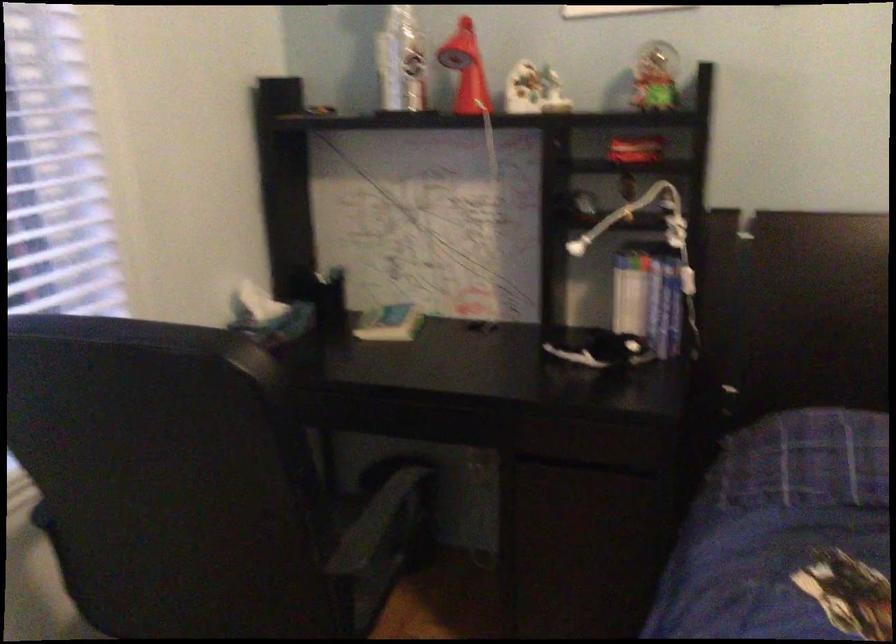
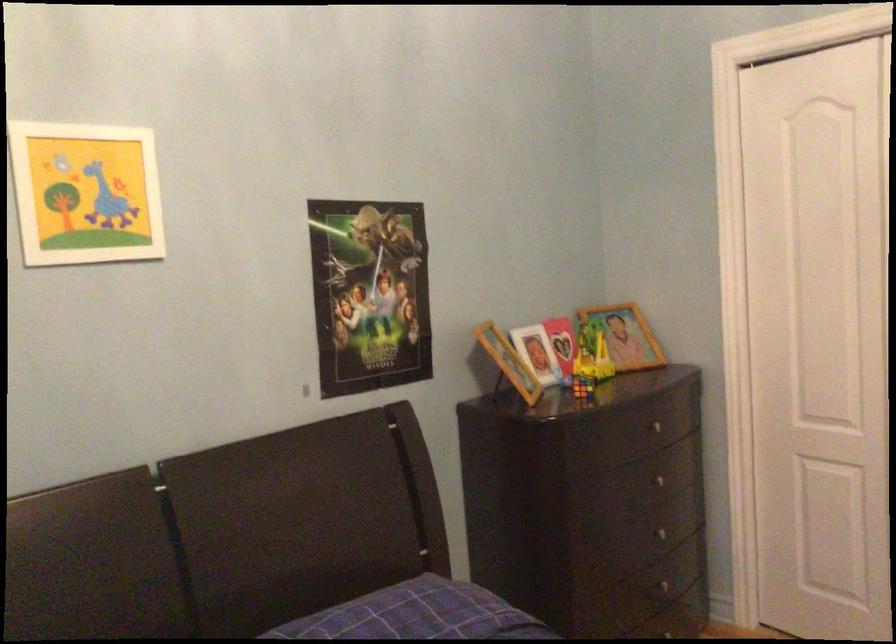
Question: The camera is either moving clockwise (left) or counter-clockwise (right) around the object. The first image is from the beginning of the video and the second image is from the end. Is the camera moving left or right when shooting the video?

Choices:
 (A) Left
 (B) Right

Answer: (A)